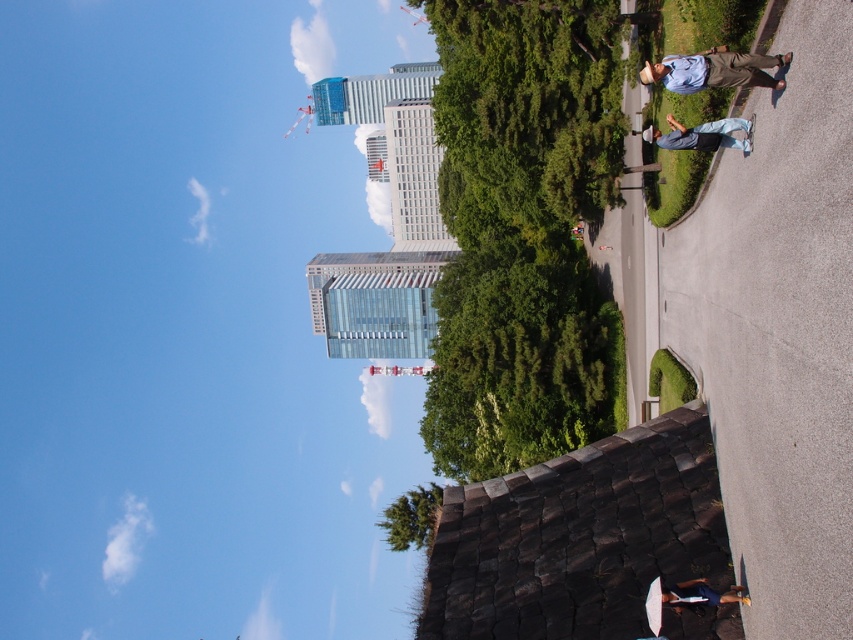
Can you confirm if green leafy tree at lower center is positioned below wooden skateboard at lower right?

Indeed, green leafy tree at lower center is positioned under wooden skateboard at lower right.

Where is `green leafy tree at lower center`? The image size is (853, 640). green leafy tree at lower center is located at coordinates (412, 516).

Locate an element on the screen. green leafy tree at lower center is located at coordinates (412, 516).

How far apart are green leafy tree at center and blue denim jeans at right?

green leafy tree at center is 112.62 feet away from blue denim jeans at right.

Does point (596, 426) come farther from viewer compared to point (735, 141)?

Yes, it is.

Identify the location of green leafy tree at center. (523, 230).

Looking at this image, is green leafy tree at center shorter than green leafy tree at lower center?

Yes.

Looking at this image, is green leafy tree at center wider than green leafy tree at lower center?

In fact, green leafy tree at center might be narrower than green leafy tree at lower center.

The image size is (853, 640). I want to click on green leafy tree at center, so click(x=523, y=230).